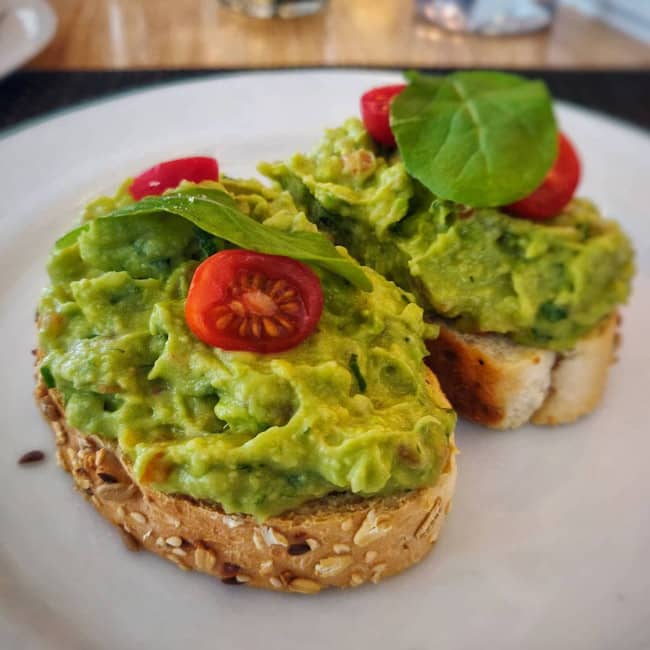
This screenshot has height=650, width=650. In order to click on white plate in this screenshot , I will do 225,619.